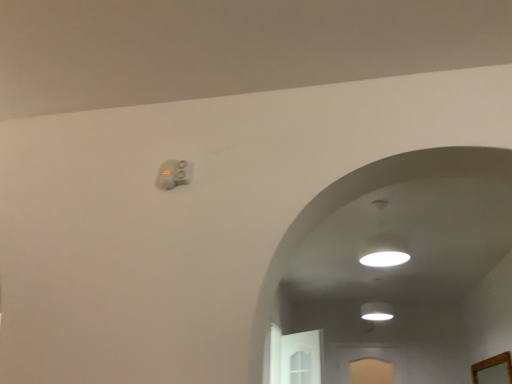
Measure the distance between wooden mirror at lower right and camera.

A distance of 13.67 feet exists between wooden mirror at lower right and camera.

Describe the element at coordinates (493, 370) in the screenshot. I see `wooden mirror at lower right` at that location.

This screenshot has height=384, width=512. Identify the location of wooden mirror at lower right. (493, 370).

Locate an element on the screen. The height and width of the screenshot is (384, 512). white glossy lampshade at upper center is located at coordinates (382, 245).

The width and height of the screenshot is (512, 384). What do you see at coordinates (382, 245) in the screenshot? I see `white glossy lampshade at upper center` at bounding box center [382, 245].

You are a GUI agent. You are given a task and a screenshot of the screen. Output one action in this format:
    pyautogui.click(x=<x>, y=<y>)
    Task: Click on the wooden mirror at lower right
    
    Given the screenshot: What is the action you would take?
    pyautogui.click(x=493, y=370)

Is wooden mirror at lower right at the left side of white glossy lampshade at upper center?

No.

Does wooden mirror at lower right lie behind white glossy lampshade at upper center?

Yes, wooden mirror at lower right is further from the camera.

Which point is more distant from viewer, [478,374] or [389,251]?

The point [478,374] is farther.

In the scene shown: From the image's perspective, who appears lower, wooden mirror at lower right or white glossy lampshade at upper center?

wooden mirror at lower right, from the image's perspective.

From a real-world perspective, who is located lower, wooden mirror at lower right or white glossy lampshade at upper center?

wooden mirror at lower right.

Does wooden mirror at lower right have a lesser width compared to white glossy lampshade at upper center?

Yes, wooden mirror at lower right is thinner than white glossy lampshade at upper center.

Who is shorter, wooden mirror at lower right or white glossy lampshade at upper center?

With less height is wooden mirror at lower right.

Considering the relative sizes of wooden mirror at lower right and white glossy lampshade at upper center in the image provided, is wooden mirror at lower right bigger than white glossy lampshade at upper center?

No, wooden mirror at lower right is not bigger than white glossy lampshade at upper center.

Which is correct: wooden mirror at lower right is inside white glossy lampshade at upper center, or outside of it?

wooden mirror at lower right is located beyond the bounds of white glossy lampshade at upper center.

Is wooden mirror at lower right next to white glossy lampshade at upper center?

There is a gap between wooden mirror at lower right and white glossy lampshade at upper center.

Is white glossy lampshade at upper center at the back of wooden mirror at lower right?

No.

How different are the orientations of wooden mirror at lower right and white glossy lampshade at upper center in degrees?

The angle between the facing direction of wooden mirror at lower right and the facing direction of white glossy lampshade at upper center is 89.4 degrees.

Measure the distance from wooden mirror at lower right to white glossy lampshade at upper center.

wooden mirror at lower right and white glossy lampshade at upper center are 6.39 feet apart from each other.

The height and width of the screenshot is (384, 512). Identify the location of mirror directly beneath the white glossy lampshade at upper center (from a real-world perspective). (493, 370).

Based on their positions, is white glossy lampshade at upper center located to the left or right of wooden mirror at lower right?

white glossy lampshade at upper center is positioned on wooden mirror at lower right's left side.

Is white glossy lampshade at upper center in front of or behind wooden mirror at lower right in the image?

Visually, white glossy lampshade at upper center is located in front of wooden mirror at lower right.

Considering the points (369, 239) and (488, 368), which point is in front, point (369, 239) or point (488, 368)?

Point (369, 239)

From the image's perspective, is white glossy lampshade at upper center located beneath wooden mirror at lower right?

No, from the image's perspective, white glossy lampshade at upper center is not beneath wooden mirror at lower right.

From a real-world perspective, is white glossy lampshade at upper center positioned over wooden mirror at lower right based on gravity?

Yes, from a real-world perspective, white glossy lampshade at upper center is on top of wooden mirror at lower right.

Considering the relative sizes of white glossy lampshade at upper center and wooden mirror at lower right in the image provided, is white glossy lampshade at upper center wider than wooden mirror at lower right?

Indeed, white glossy lampshade at upper center has a greater width compared to wooden mirror at lower right.

Considering the relative sizes of white glossy lampshade at upper center and wooden mirror at lower right in the image provided, is white glossy lampshade at upper center shorter than wooden mirror at lower right?

No.

Based on their sizes in the image, would you say white glossy lampshade at upper center is bigger or smaller than wooden mirror at lower right?

Clearly, white glossy lampshade at upper center is larger in size than wooden mirror at lower right.

Choose the correct answer: Is white glossy lampshade at upper center inside wooden mirror at lower right or outside it?

white glossy lampshade at upper center is not inside wooden mirror at lower right, it's outside.

Are white glossy lampshade at upper center and wooden mirror at lower right located far from each other?

Yes, white glossy lampshade at upper center and wooden mirror at lower right are quite far apart.

Is white glossy lampshade at upper center positioned with its back to wooden mirror at lower right?

white glossy lampshade at upper center does not have its back to wooden mirror at lower right.

Looking at this image, how different are the orientations of white glossy lampshade at upper center and wooden mirror at lower right in degrees?

They differ by 89.4 degrees in their facing directions.

Where is `mirror located behind the white glossy lampshade at upper center`? The image size is (512, 384). mirror located behind the white glossy lampshade at upper center is located at coordinates (493, 370).

The image size is (512, 384). I want to click on lamp that is on the left side of wooden mirror at lower right, so click(x=382, y=245).

Locate an element on the screen. This screenshot has height=384, width=512. lamp located in front of the wooden mirror at lower right is located at coordinates (382, 245).